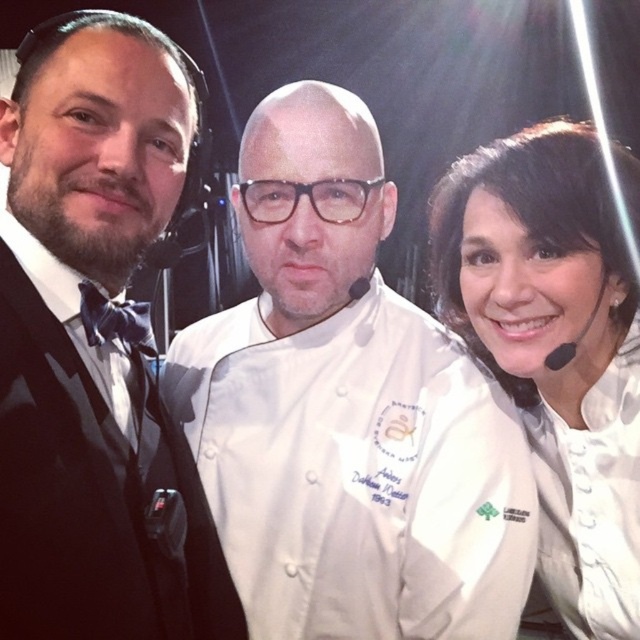
Question: Which point is closer to the camera?

Choices:
 (A) white matte chef coat at center
 (B) black satin bow tie at left
 (C) white chef coat at center

Answer: (B)

Question: Which point is farther from the camera taking this photo?

Choices:
 (A) (440, 493)
 (B) (92, 337)
 (C) (614, 310)

Answer: (C)

Question: Does white chef coat at center have a lesser width compared to black satin bow tie at left?

Choices:
 (A) no
 (B) yes

Answer: (A)

Question: Which of the following is the closest to the observer?

Choices:
 (A) white chef coat at center
 (B) black satin bow tie at left

Answer: (B)

Question: Is white chef coat at center above black satin bow tie at left?

Choices:
 (A) yes
 (B) no

Answer: (B)

Question: Is black satin bow tie at left smaller than white matte chef coat at center?

Choices:
 (A) no
 (B) yes

Answer: (B)